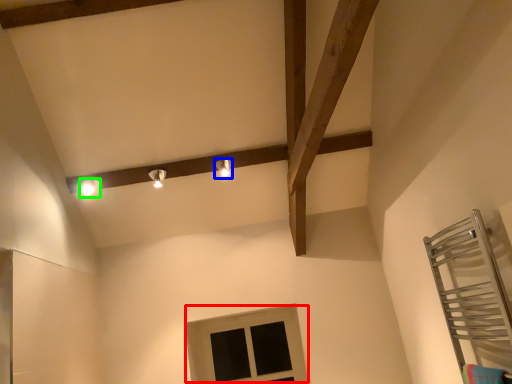
Question: Which object is the closest to the window (highlighted by a red box)? Choose among these: light fixture (highlighted by a blue box) or light fixture (highlighted by a green box).

Choices:
 (A) light fixture
 (B) light fixture

Answer: (A)